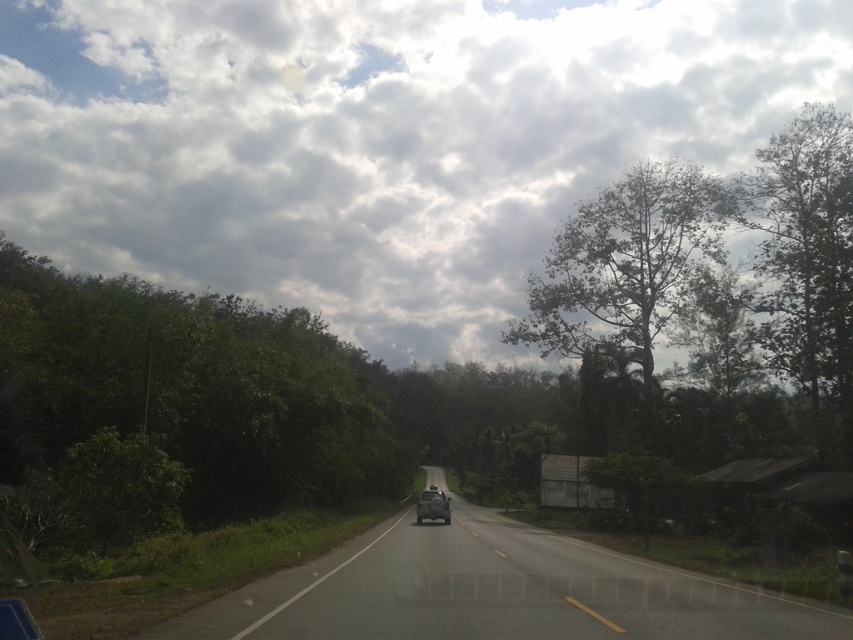
You are driving on the rural road and want to navigate using landmarks. What are the coordinates of the cloudy sky at upper center in the image?

The cloudy sky at upper center is located at coordinates point (x=376, y=140).